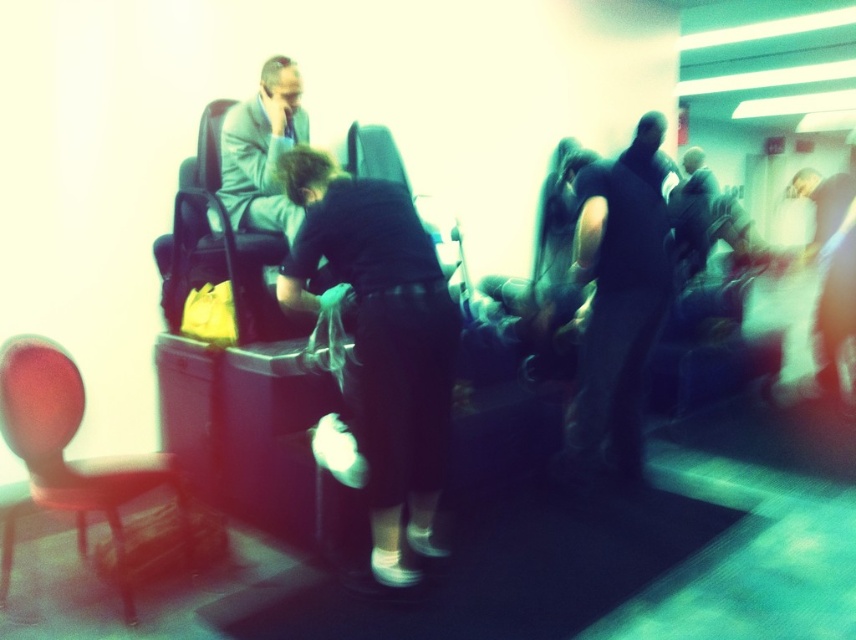
You are a passenger trying to find a seat in the train car. You see the matte red chair at left and the matte black chair at upper left. Which chair is closer to the front of the train car?

The matte black chair at upper left is closer to the front of the train car because it is positioned above the matte red chair at left, indicating it is nearer to the front direction.

You are a passenger trying to find a seat in the train car. You see the matte red chair at left and the matte black chair at upper left. Which chair is closer to the entrance of the train car?

The matte red chair at left is positioned on the left side of the matte black chair at upper left, so the matte red chair at left is closer to the entrance of the train car.

You are a passenger on a train and want to sit down. There is a dark fabric shirt at center and a matte black chair at center. Which object is closer to the floor?

The dark fabric shirt at center is located below matte black chair at center, so the dark fabric shirt at center is closer to the floor.